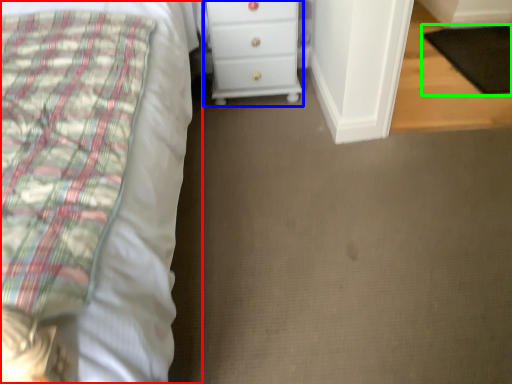
Question: Considering the real-world distances, which object is farthest from bed (highlighted by a red box)? chest of drawers (highlighted by a blue box) or pad (highlighted by a green box)?

Choices:
 (A) chest of drawers
 (B) pad

Answer: (B)